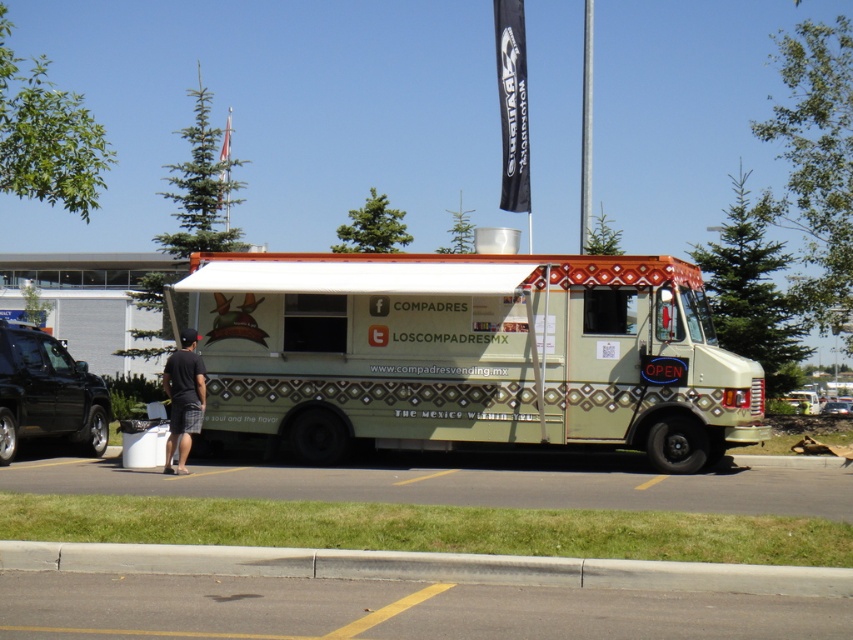
Question: Which object appears farthest from the camera in this image?

Choices:
 (A) silver metallic pole at center
 (B) black fabric flagpole at upper center
 (C) gray concrete curb at lower center

Answer: (B)

Question: Can you confirm if dark gray shorts at lower left is positioned above black fabric flagpole at upper center?

Choices:
 (A) no
 (B) yes

Answer: (A)

Question: Is green matte food truck at center closer to camera compared to gray concrete curb at lower center?

Choices:
 (A) yes
 (B) no

Answer: (B)

Question: Which object is positioned closest to the gray concrete curb at lower center?

Choices:
 (A) black fabric flagpole at upper center
 (B) dark gray shorts at lower left
 (C) silver metallic pole at center
 (D) green matte food truck at center

Answer: (B)

Question: From the image, what is the correct spatial relationship of dark gray shorts at lower left in relation to black fabric flagpole at upper center?

Choices:
 (A) below
 (B) above

Answer: (A)

Question: Which point is farther to the camera?

Choices:
 (A) click(589, 182)
 (B) click(228, 179)
 (C) click(169, 456)

Answer: (A)